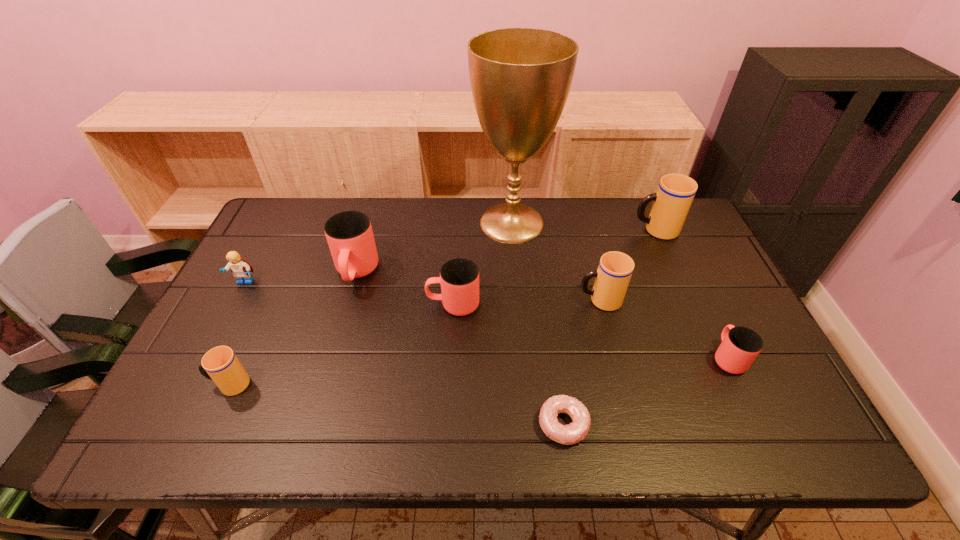
At what (x,y) coordinates should I click in order to perform the action: click on blank area located 0.190m on the handle side of the biggest pink cup. Please return your answer as a coordinate pair (x, y). The image size is (960, 540). Looking at the image, I should click on (334, 352).

Find the location of a particular element. free space located 0.230m on the side of the third object from right to left with the handle is located at coordinates (494, 300).

The height and width of the screenshot is (540, 960). Identify the location of vacant space located on the side of the third object from right to left with the handle. tap(433, 300).

Image resolution: width=960 pixels, height=540 pixels. Find the location of `free spot located on the side of the third object from right to left with the handle`. free spot located on the side of the third object from right to left with the handle is located at coordinates (437, 300).

This screenshot has width=960, height=540. I want to click on blank space located 0.360m on the handle side of the second pink cup from left to right, so click(x=296, y=305).

At what (x,y) coordinates should I click in order to perform the action: click on free space located 0.130m on the handle side of the second pink cup from left to right. Please return your answer as a coordinate pair (x, y). This screenshot has height=540, width=960. Looking at the image, I should click on (379, 305).

Locate an element on the screen. The image size is (960, 540). vacant area located 0.110m on the handle side of the second pink cup from left to right is located at coordinates (387, 305).

The width and height of the screenshot is (960, 540). I want to click on vacant space located 0.330m on the front-facing side of the Lego, so click(186, 394).

You are a GUI agent. You are given a task and a screenshot of the screen. Output one action in this format:
    pyautogui.click(x=<x>, y=<y>)
    Task: Click on the blank space located 0.160m on the handle side of the smallest pink cup
    This screenshot has height=540, width=960.
    Given the screenshot: What is the action you would take?
    pyautogui.click(x=697, y=294)

Find the location of a particular element. The image size is (960, 540). vacant space located on the handle side of the smallest pink cup is located at coordinates (702, 305).